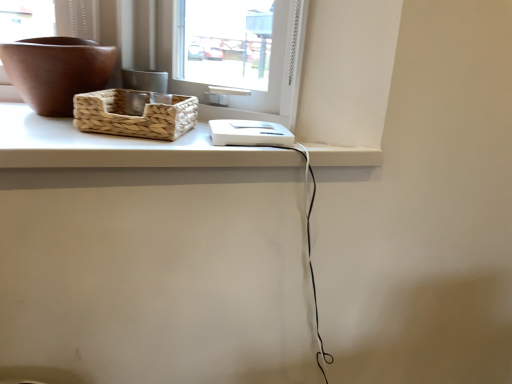
Question: Does woven natural picnic basket at upper left have a larger size compared to brown matte bowl at upper left?

Choices:
 (A) no
 (B) yes

Answer: (A)

Question: Is the position of woven natural picnic basket at upper left less distant than that of brown matte bowl at upper left?

Choices:
 (A) no
 (B) yes

Answer: (B)

Question: Are woven natural picnic basket at upper left and brown matte bowl at upper left located far from each other?

Choices:
 (A) yes
 (B) no

Answer: (B)

Question: From the image's perspective, is woven natural picnic basket at upper left located beneath brown matte bowl at upper left?

Choices:
 (A) no
 (B) yes

Answer: (B)

Question: Is woven natural picnic basket at upper left oriented towards brown matte bowl at upper left?

Choices:
 (A) yes
 (B) no

Answer: (B)

Question: Is woven natural picnic basket at upper left to the left of brown matte bowl at upper left from the viewer's perspective?

Choices:
 (A) no
 (B) yes

Answer: (A)

Question: Is woven natural picnic basket at upper left inside brown matte bowl at upper left?

Choices:
 (A) no
 (B) yes

Answer: (A)

Question: Does brown matte bowl at upper left have a greater width compared to woven natural picnic basket at upper left?

Choices:
 (A) no
 (B) yes

Answer: (A)

Question: Can you confirm if brown matte bowl at upper left is positioned to the right of woven natural picnic basket at upper left?

Choices:
 (A) no
 (B) yes

Answer: (A)

Question: Is brown matte bowl at upper left not inside woven natural picnic basket at upper left?

Choices:
 (A) yes
 (B) no

Answer: (A)

Question: Considering the relative positions of brown matte bowl at upper left and woven natural picnic basket at upper left in the image provided, is brown matte bowl at upper left in front of woven natural picnic basket at upper left?

Choices:
 (A) no
 (B) yes

Answer: (A)

Question: Is brown matte bowl at upper left taller than woven natural picnic basket at upper left?

Choices:
 (A) yes
 (B) no

Answer: (A)

Question: Does woven natural picnic basket at upper left turn towards white matte counter top at upper center?

Choices:
 (A) no
 (B) yes

Answer: (A)